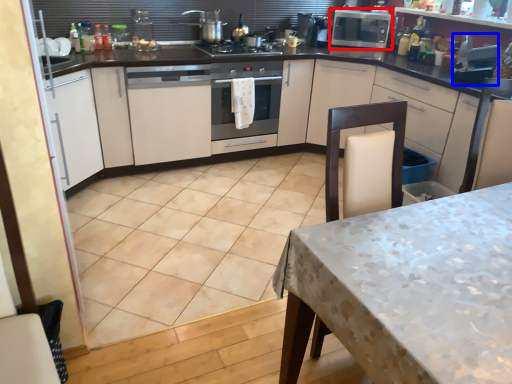
Question: Which object appears closest to the camera in this image, kitchen appliance (highlighted by a red box) or appliance (highlighted by a blue box)?

Choices:
 (A) kitchen appliance
 (B) appliance

Answer: (B)